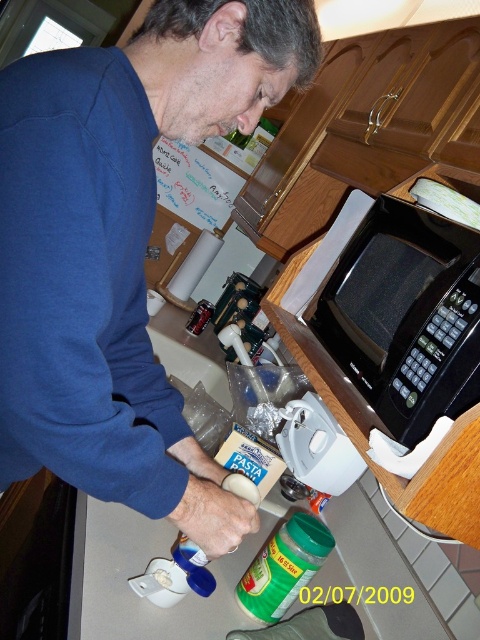
Is blue matte shirt at upper left to the right of white matte pasta at center from the viewer's perspective?

No, blue matte shirt at upper left is not to the right of white matte pasta at center.

Does blue matte shirt at upper left have a greater height compared to white matte pasta at center?

Indeed, blue matte shirt at upper left has a greater height compared to white matte pasta at center.

Does point (139, 204) come behind point (166, 582)?

No, it is in front of (166, 582).

Identify the location of blue matte shirt at upper left. Image resolution: width=480 pixels, height=640 pixels. (120, 248).

The image size is (480, 640). Describe the element at coordinates (120, 248) in the screenshot. I see `blue matte shirt at upper left` at that location.

Can you confirm if blue matte shirt at upper left is positioned below white glossy counter top at lower center?

Actually, blue matte shirt at upper left is above white glossy counter top at lower center.

Which is behind, point (88, 77) or point (385, 580)?

The point (385, 580) is more distant.

This screenshot has width=480, height=640. Find the location of `blue matte shirt at upper left`. blue matte shirt at upper left is located at coordinates (120, 248).

Between white glossy counter top at lower center and black plastic microwave at upper right, which one appears on the right side from the viewer's perspective?

From the viewer's perspective, black plastic microwave at upper right appears more on the right side.

Can you confirm if white glossy counter top at lower center is smaller than black plastic microwave at upper right?

Actually, white glossy counter top at lower center might be larger than black plastic microwave at upper right.

Which is in front, point (360, 545) or point (385, 300)?

Point (385, 300) is more forward.

The image size is (480, 640). What are the coordinates of `white glossy counter top at lower center` in the screenshot? It's located at (143, 570).